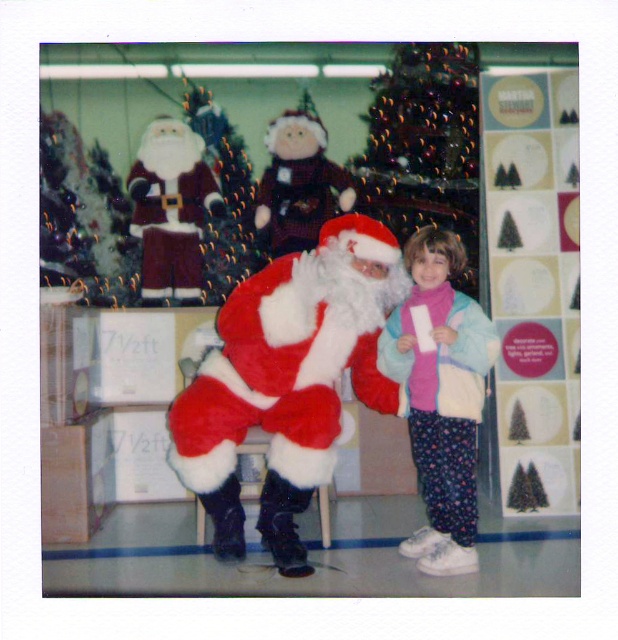
Question: Does shiny gold ornaments at center appear on the right side of shiny green christmas tree at upper center?

Choices:
 (A) no
 (B) yes

Answer: (B)

Question: Does fluffy pink sweater at center have a smaller size compared to shiny green christmas tree at upper left?

Choices:
 (A) no
 (B) yes

Answer: (A)

Question: Which of the following is the farthest from the observer?

Choices:
 (A) shiny green christmas tree at upper left
 (B) fuzzy red santa at center
 (C) shiny green christmas tree at upper center
 (D) fluffy pink sweater at center

Answer: (A)

Question: Can you confirm if fuzzy red santa at center is bigger than shiny gold ornaments at center?

Choices:
 (A) no
 (B) yes

Answer: (B)

Question: Which is farther from the fuzzy red santa at center?

Choices:
 (A) shiny green christmas tree at upper left
 (B) fluffy pink sweater at center
 (C) shiny gold ornaments at center

Answer: (A)

Question: Among these objects, which one is nearest to the camera?

Choices:
 (A) shiny green christmas tree at upper left
 (B) fluffy pink sweater at center
 (C) fuzzy red santa at center
 (D) shiny green christmas tree at upper center

Answer: (C)